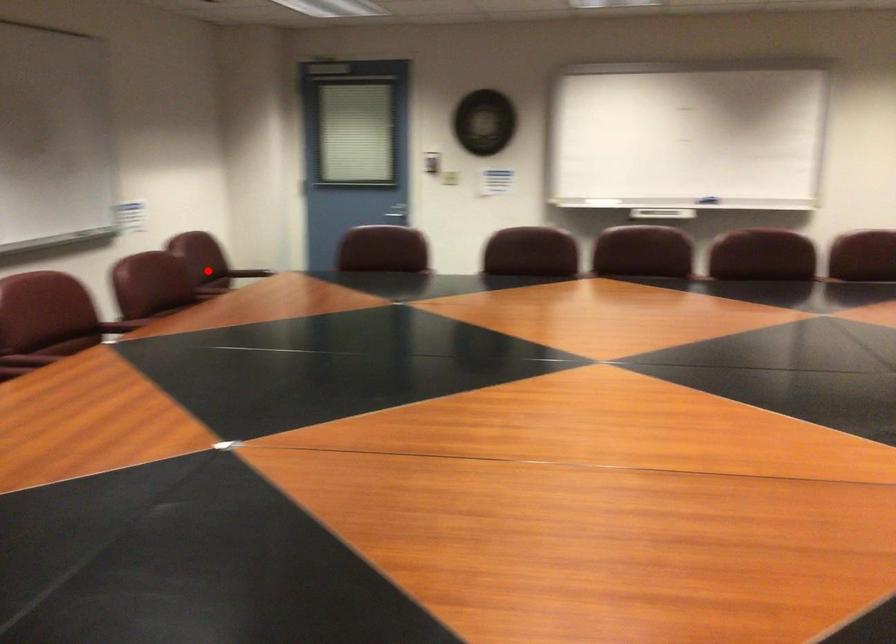
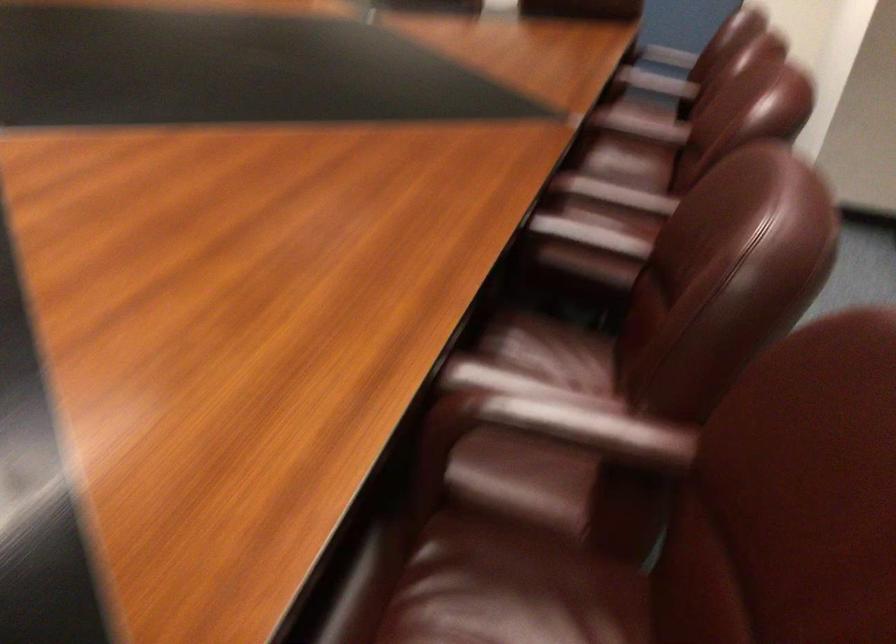
Question: I am providing you with two images of the same scene from different viewpoints. A red point is shown in image1. For the corresponding object point in image2, is it positioned nearer or farther from the camera?

Choices:
 (A) Nearer
 (B) Farther

Answer: (A)